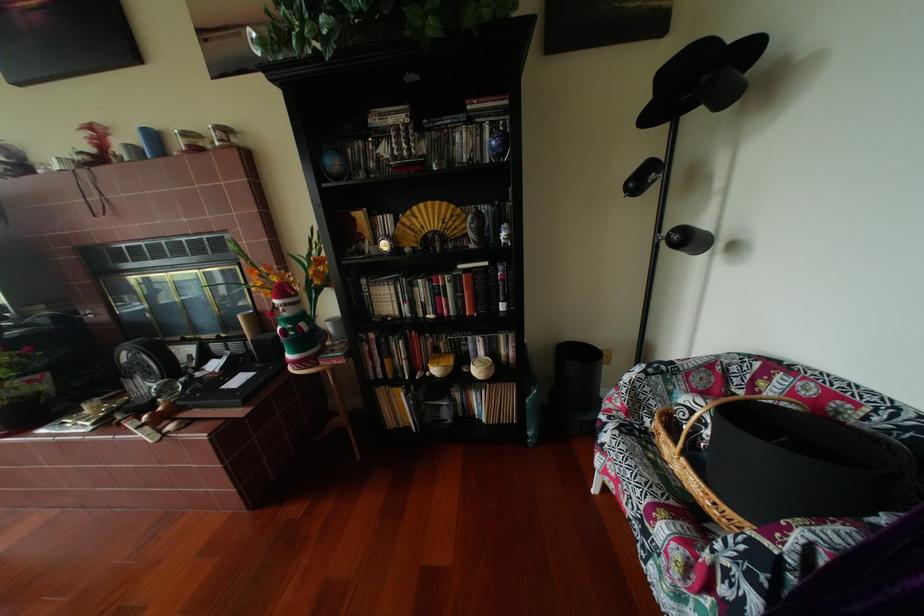
Where would you lift the small woven basket? Please return your answer as a coordinate pair (x, y).

(481, 368)